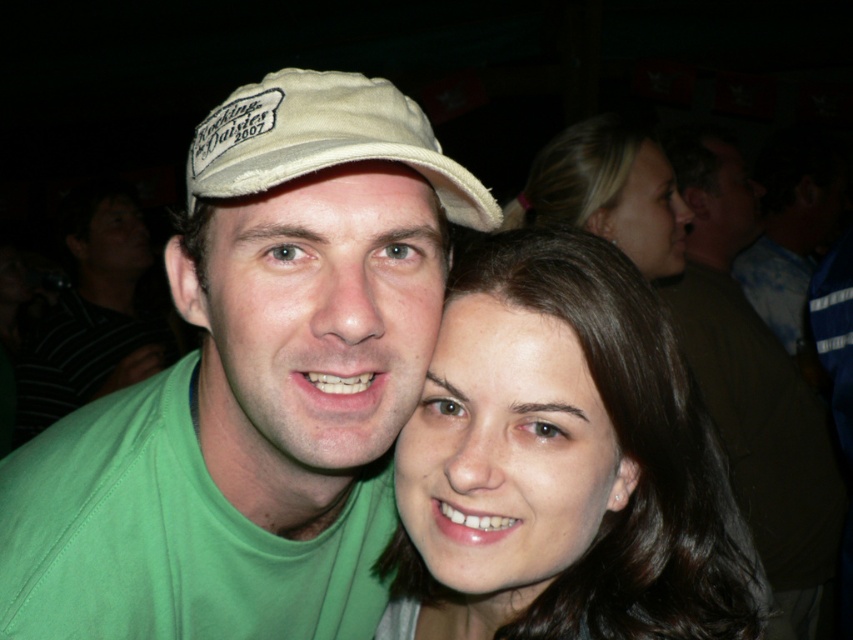
You are a photographer at a social event. You want to capture a close portrait of both the smooth brown hair at center and the green fabric shirt at left. Given that your camera has a minimum focusing distance of 5 feet, will you be able to take the photo without moving either subject?

The distance between the smooth brown hair at center and the green fabric shirt at left is 6.63 feet, which is greater than the camera minimum focusing distance of 5 feet. Therefore, you can take the photo without moving the subjects.

You are a photographer trying to adjust the lighting for a group photo. You notice two elements in the frame, the smooth brown hair at center and the green fabric shirt at left. Which of these elements is positioned lower in the frame?

The smooth brown hair at center has a lesser height compared to the green fabric shirt at left, so it is positioned lower in the frame.